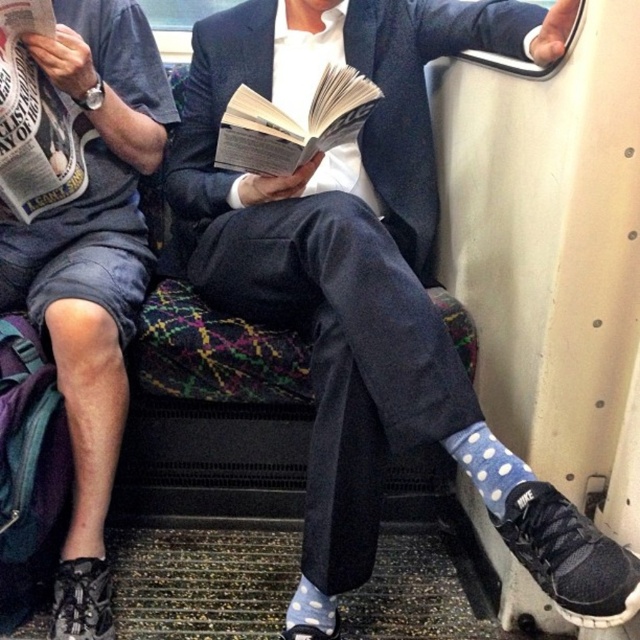
You are standing on the train and see the point at coordinates (369, 280). Which object is located at that point?

The point at coordinates (369, 280) is located on the blue polka dot socks at lower center.

You are a passenger on the train and want to know which item is closer to you. Which is closer, the blue polka dot socks at lower center or the matte gray shorts at left?

The blue polka dot socks at lower center is in front of the matte gray shorts at left, so it is closer to you.

You are a photographer taking a picture of the blue polka dot socks at lower center and the matte gray shorts at left. Which object should you focus on to ensure the socks are visible in the photo?

The blue polka dot socks at lower center is positioned over matte gray shorts at left, so you should focus on the blue polka dot socks at lower center to ensure they are visible in the photo.